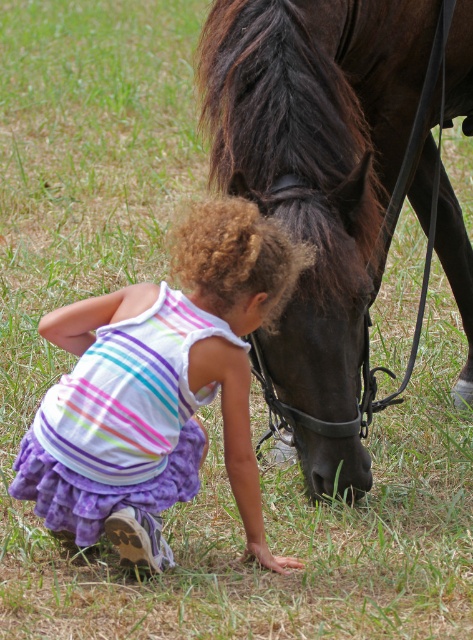
Question: Is shiny dark brown horse at center to the right of striped fabric dress at lower center from the viewer's perspective?

Choices:
 (A) no
 (B) yes

Answer: (B)

Question: In this image, where is shiny dark brown horse at center located relative to striped fabric dress at lower center?

Choices:
 (A) above
 (B) below

Answer: (A)

Question: Does shiny dark brown horse at center appear on the left side of striped fabric dress at lower center?

Choices:
 (A) yes
 (B) no

Answer: (B)